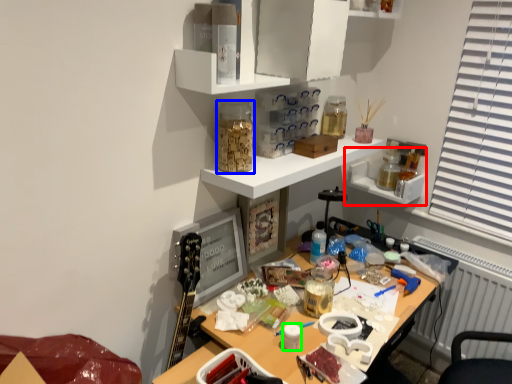
Question: Estimate the real-world distances between objects in this image. Which object is closer to shelf (highlighted by a red box), stationery (highlighted by a blue box) or stationery (highlighted by a green box)?

Choices:
 (A) stationery
 (B) stationery

Answer: (A)